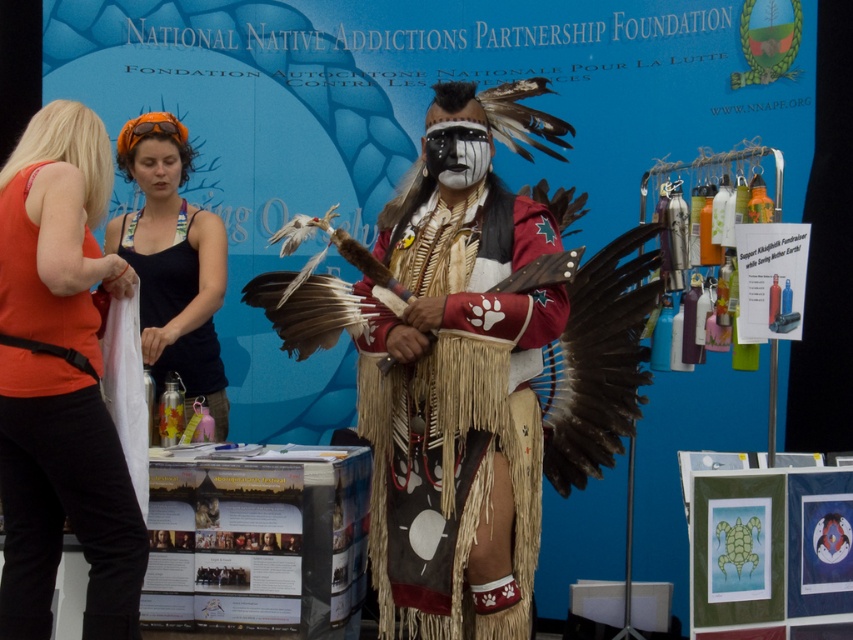
Question: Is fur-like fringed skirt at center further to camera compared to orange fabric headband at left?

Choices:
 (A) yes
 (B) no

Answer: (A)

Question: Estimate the real-world distances between objects in this image. Which object is closer to the fur-like fringed skirt at center?

Choices:
 (A) orange fabric headband at left
 (B) orange fabric headband at upper left

Answer: (B)

Question: Does fur-like fringed skirt at center have a larger size compared to orange fabric headband at upper left?

Choices:
 (A) no
 (B) yes

Answer: (A)

Question: Which object is the farthest from the orange fabric headband at upper left?

Choices:
 (A) fur-like fringed skirt at center
 (B) orange fabric headband at left

Answer: (A)

Question: Estimate the real-world distances between objects in this image. Which object is farther from the orange fabric headband at left?

Choices:
 (A) fur-like fringed skirt at center
 (B) orange fabric headband at upper left

Answer: (A)

Question: Is fur-like fringed skirt at center positioned at the back of orange fabric headband at upper left?

Choices:
 (A) yes
 (B) no

Answer: (B)